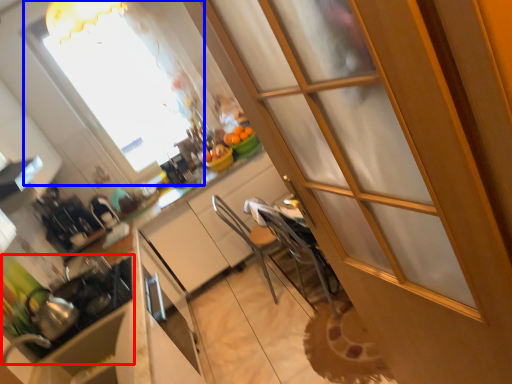
Question: Which of the following is the farthest to the observer, appliance (highlighted by a red box) or window (highlighted by a blue box)?

Choices:
 (A) appliance
 (B) window

Answer: (B)